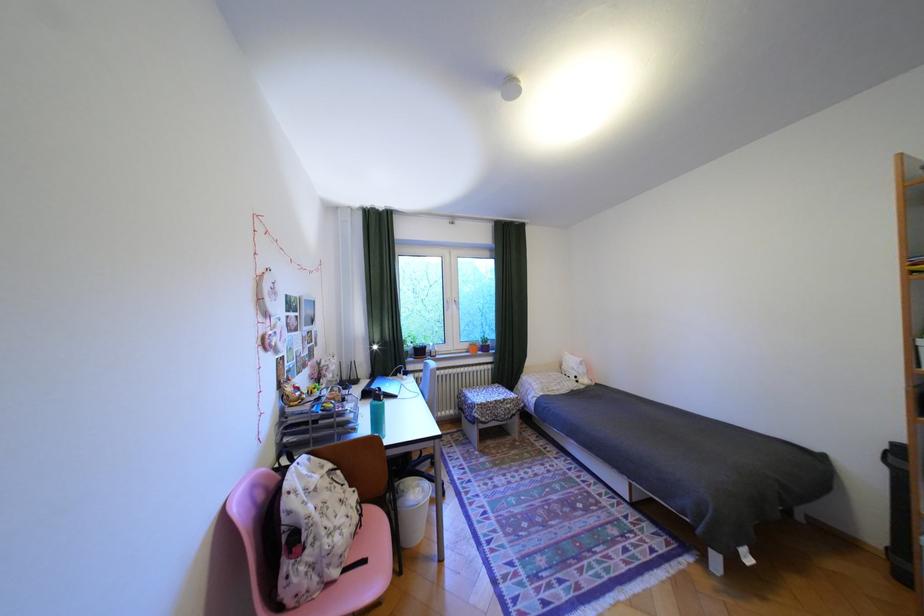
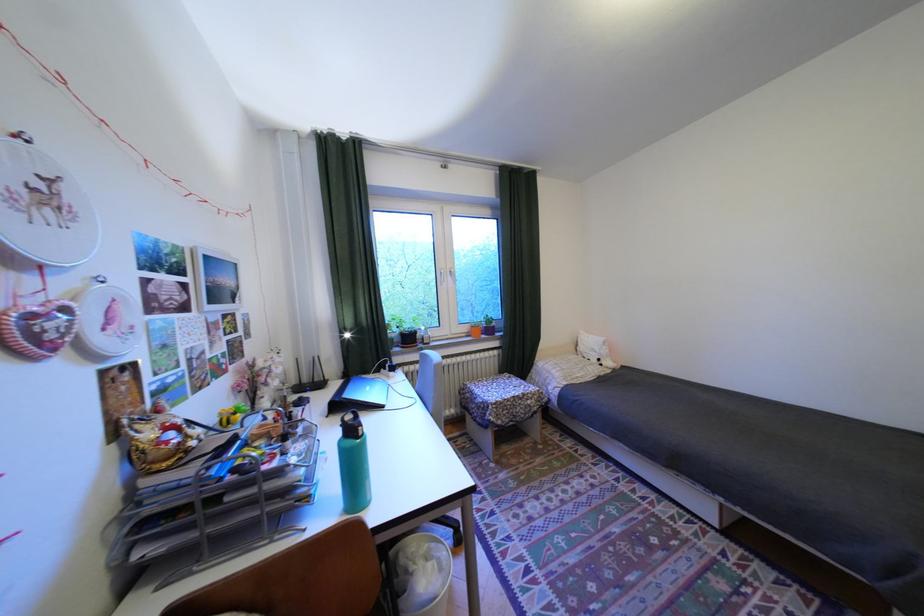
In the second image, find the point that corresponds to pixel 388 403 in the first image.

(361, 443)